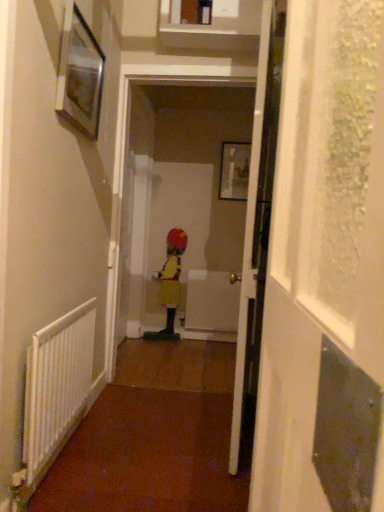
Question: Are yellow matte dress at center and white plastic radiator at left making contact?

Choices:
 (A) yes
 (B) no

Answer: (B)

Question: Is yellow matte dress at center facing away from white plastic radiator at left?

Choices:
 (A) no
 (B) yes

Answer: (A)

Question: Would you say yellow matte dress at center is a long distance from white plastic radiator at left?

Choices:
 (A) no
 (B) yes

Answer: (B)

Question: Is yellow matte dress at center to the right of white plastic radiator at left from the viewer's perspective?

Choices:
 (A) no
 (B) yes

Answer: (B)

Question: Is yellow matte dress at center bigger than white plastic radiator at left?

Choices:
 (A) no
 (B) yes

Answer: (B)

Question: Can you confirm if yellow matte dress at center is taller than white plastic radiator at left?

Choices:
 (A) yes
 (B) no

Answer: (A)

Question: Is white glossy door at center directly adjacent to metallic silver picture frame at upper left, placed as the first picture frame when sorted from left to right?

Choices:
 (A) yes
 (B) no

Answer: (B)

Question: From the image's perspective, would you say white glossy door at center is shown under metallic silver picture frame at upper left, which is the first picture frame from front to back?

Choices:
 (A) yes
 (B) no

Answer: (A)

Question: Does white glossy door at center lie in front of metallic silver picture frame at upper left, placed as the first picture frame when sorted from left to right?

Choices:
 (A) yes
 (B) no

Answer: (B)

Question: From the image's perspective, does white glossy door at center appear higher than metallic silver picture frame at upper left, marked as the 2th picture frame in a back-to-front arrangement?

Choices:
 (A) yes
 (B) no

Answer: (B)

Question: Considering the relative sizes of white glossy door at center and metallic silver picture frame at upper left, which ranks as the second picture frame in right-to-left order, in the image provided, is white glossy door at center wider than metallic silver picture frame at upper left, which ranks as the second picture frame in right-to-left order,?

Choices:
 (A) no
 (B) yes

Answer: (B)

Question: Is white glossy door at center smaller than metallic silver picture frame at upper left, placed as the first picture frame when sorted from left to right?

Choices:
 (A) yes
 (B) no

Answer: (B)

Question: Is transparent textured screen door at right outside of metallic silver picture frame at upper left, marked as the 2th picture frame in a back-to-front arrangement?

Choices:
 (A) yes
 (B) no

Answer: (A)